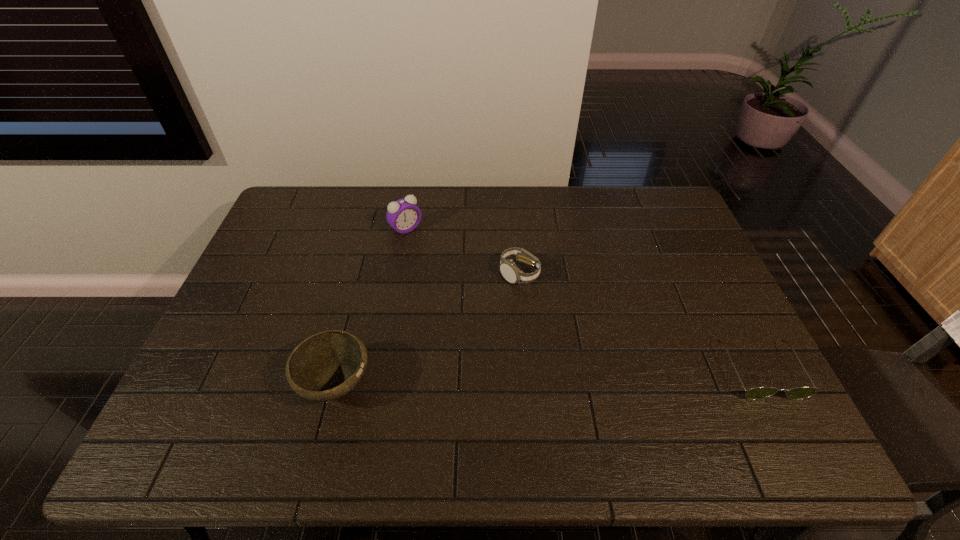
This screenshot has width=960, height=540. I want to click on vacant spot on the desktop that is between the bowl and the shortest object and is positioned on the face of the watch, so click(x=544, y=377).

Identify the location of vacant space on the desktop that is between the bowl and the sunglasses and is positioned on the face of the farthest object. This screenshot has width=960, height=540. (555, 377).